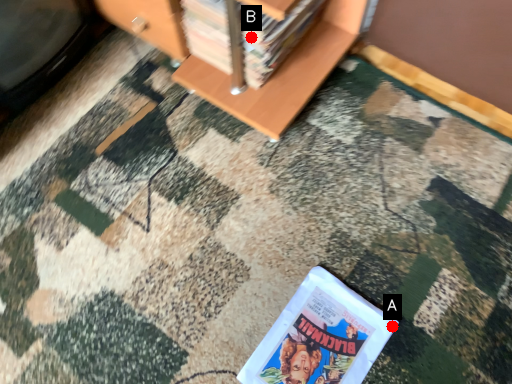
Question: Two points are circled on the image, labeled by A and B beside each circle. Which point appears closest to the camera in this image?

Choices:
 (A) A is closer
 (B) B is closer

Answer: (A)